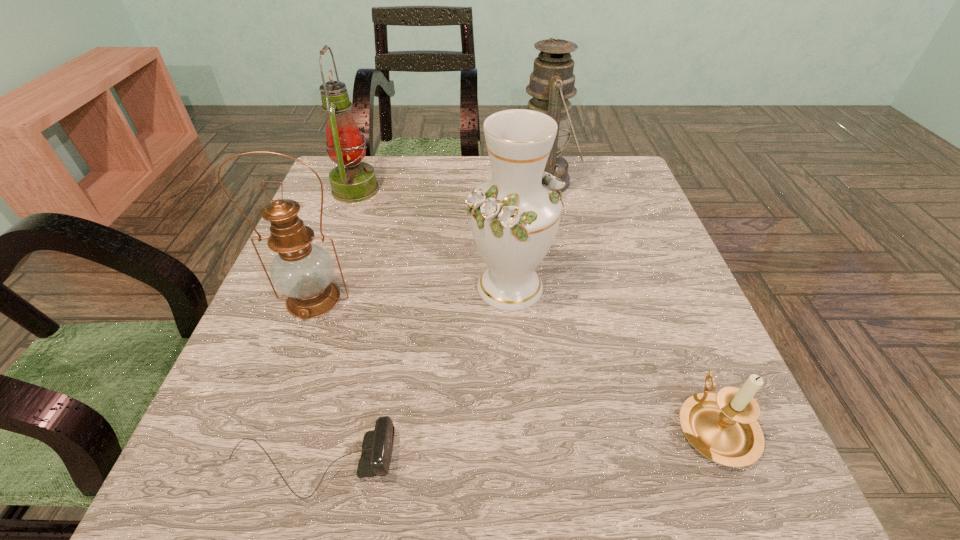
Identify the location of object present at the far right corner. (552, 81).

Where is `object present at the near right corner`? object present at the near right corner is located at coordinates (723, 427).

At what (x,y) coordinates should I click in order to perform the action: click on vacant region at the far edge of the desktop. Please return your answer as a coordinate pair (x, y). Image resolution: width=960 pixels, height=540 pixels. Looking at the image, I should click on (461, 184).

Identify the location of vacant space at the near edge. This screenshot has width=960, height=540. 557,500.

Locate an element on the screen. vacant point at the left edge is located at coordinates (370, 217).

This screenshot has width=960, height=540. Find the location of `free space at the right edge of the desktop`. free space at the right edge of the desktop is located at coordinates (648, 306).

The width and height of the screenshot is (960, 540). In the image, there is a desktop. Find the location of `blank space at the far left corner`. blank space at the far left corner is located at coordinates (320, 192).

What are the coordinates of `free space at the far right corner of the desktop` in the screenshot? It's located at (599, 164).

You are a GUI agent. You are given a task and a screenshot of the screen. Output one action in this format:
    pyautogui.click(x=<x>, y=<y>)
    Task: Click on the free spot between the webcam and the nearest oil lamp
    The height and width of the screenshot is (540, 960).
    Given the screenshot: What is the action you would take?
    pyautogui.click(x=312, y=382)

Identify the location of free space that is in between the vase and the nearest oil lamp. (412, 293).